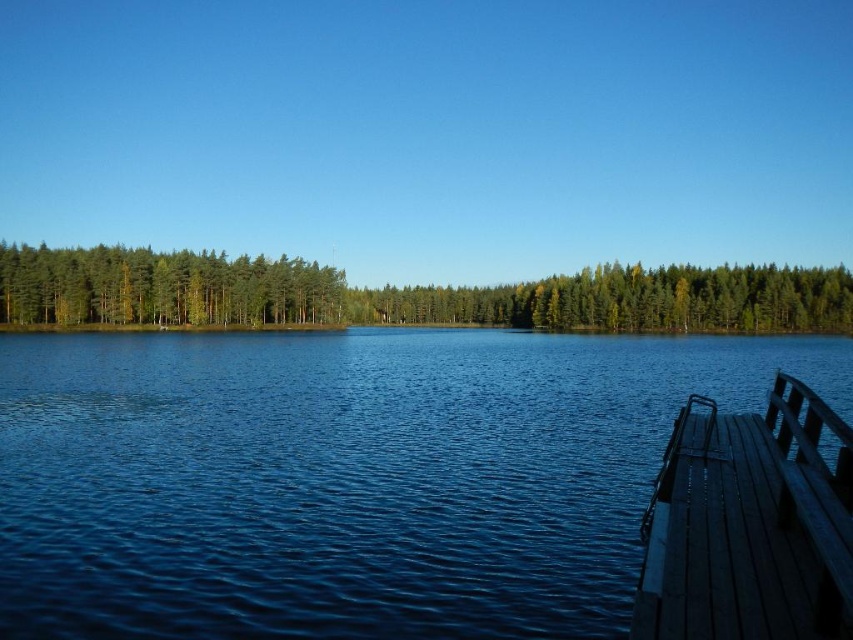
Measure the distance between green matte trees at upper center and camera.

A distance of 94.47 meters exists between green matte trees at upper center and camera.

Image resolution: width=853 pixels, height=640 pixels. Find the location of `green matte trees at upper center`. green matte trees at upper center is located at coordinates (409, 294).

Who is lower down, blue water at center or wooden dock at lower right?

wooden dock at lower right

Can you confirm if blue water at center is wider than wooden dock at lower right?

Indeed, blue water at center has a greater width compared to wooden dock at lower right.

Find the location of a particular element. This screenshot has height=640, width=853. blue water at center is located at coordinates (349, 477).

Where is `blue water at center`? blue water at center is located at coordinates (349, 477).

Who is taller, green matte trees at upper center or green matte trees at left?

With more height is green matte trees at upper center.

Between point (224, 321) and point (225, 280), which one is positioned behind?

The point (225, 280) is more distant.

Between point (134, 272) and point (18, 321), which one is positioned behind?

Point (134, 272)

Where is `green matte trees at upper center`? Image resolution: width=853 pixels, height=640 pixels. green matte trees at upper center is located at coordinates (409, 294).